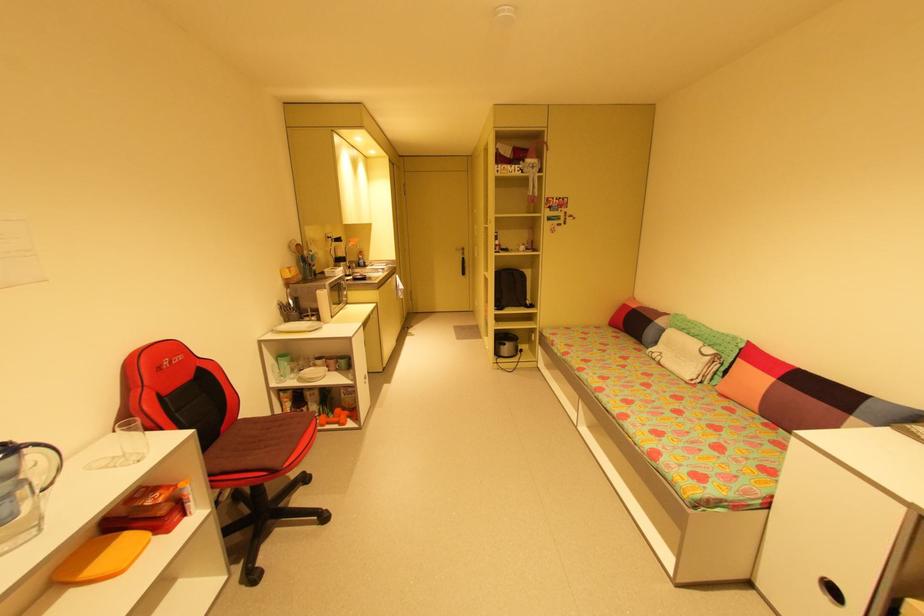
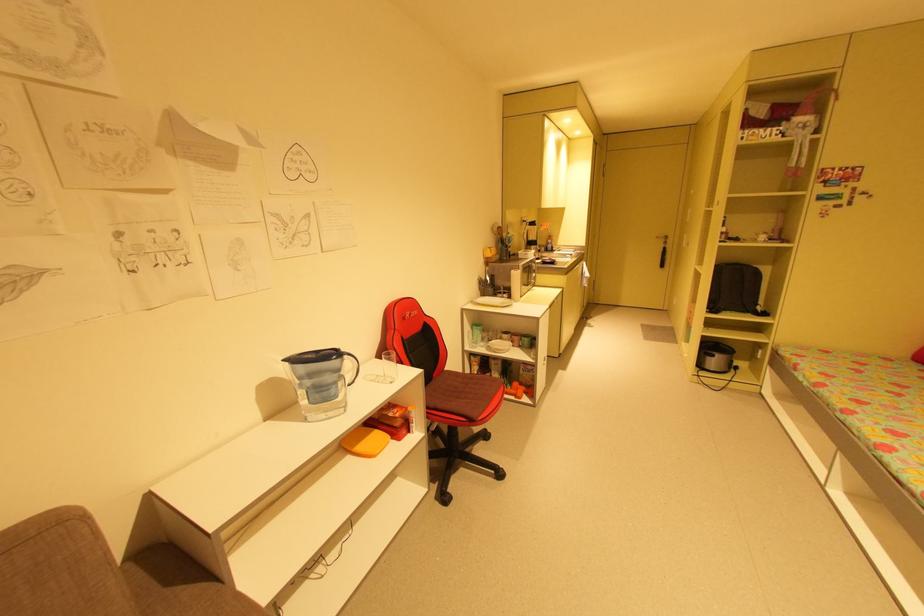
Question: The camera is either moving clockwise (left) or counter-clockwise (right) around the object. The first image is from the beginning of the video and the second image is from the end. Is the camera moving left or right when shooting the video?

Choices:
 (A) Left
 (B) Right

Answer: (B)